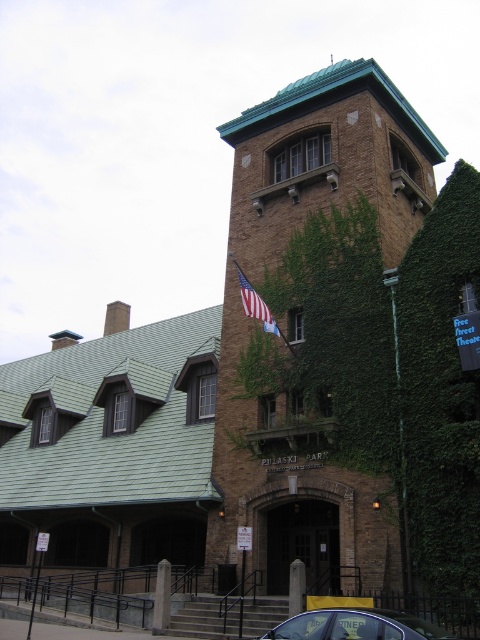
You are standing at point (x=356, y=625) in the historic building scene. What object is located at this point?

The metallic blue car at lower center is located at point (x=356, y=625).